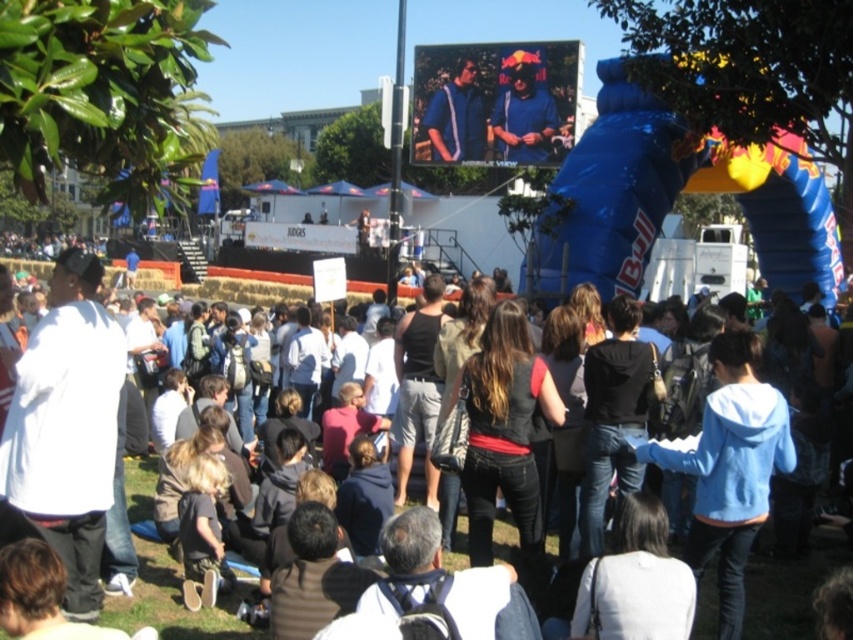
Question: Which of the following is the closest to the observer?

Choices:
 (A) tap(482, 106)
 (B) tap(508, 147)
 (C) tap(820, 554)

Answer: (C)

Question: Is dark blue jeans at center bigger than blue fabric jacket at upper center?

Choices:
 (A) yes
 (B) no

Answer: (A)

Question: Which point is closer to the camera taking this photo?

Choices:
 (A) (125, 602)
 (B) (456, 74)
 (C) (503, 147)

Answer: (A)

Question: Can you confirm if dark blue jeans at center is thinner than blue fabric jacket at upper center?

Choices:
 (A) yes
 (B) no

Answer: (B)

Question: Is dark blue jeans at center positioned behind matte blue jacket at center?

Choices:
 (A) yes
 (B) no

Answer: (B)

Question: Which object is farther from the camera taking this photo?

Choices:
 (A) blue fabric jacket at upper center
 (B) matte blue jacket at center

Answer: (A)